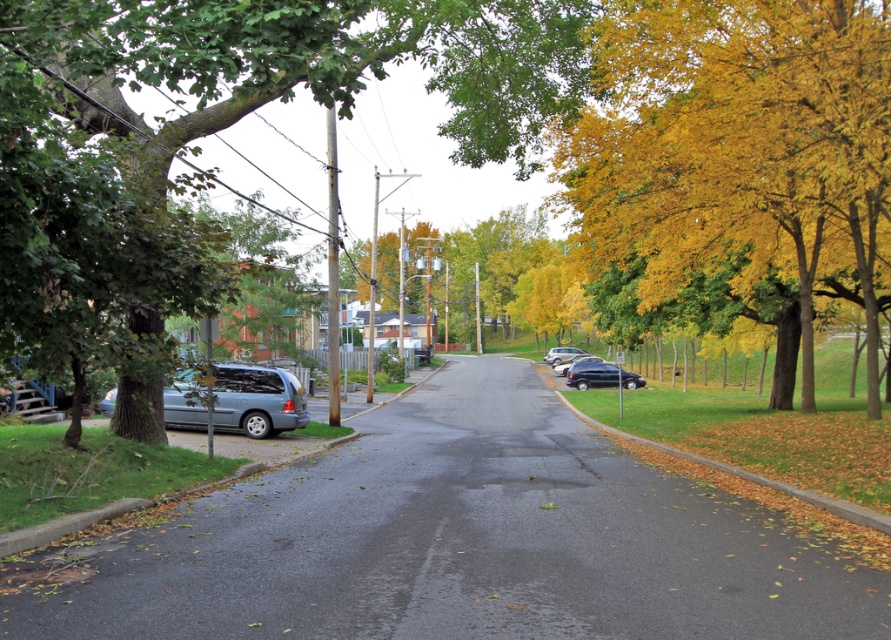
You are standing on the residential street and want to walk to the point marked at coordinates (554, 330). How far will you have to walk to reach that point?

The point at coordinates (554, 330) is 88.24 meters away from your current position, so you will have to walk 88.24 meters to reach it.

Based on the photo, you are a delivery person trying to park your van behind the shiny black sedan at center so that it is hidden from view from the road. Can you park the van behind the green leafy tree at left to block the view of the sedan?

The green leafy tree at left is taller than the shiny black sedan at center, so parking the van behind the tree would effectively block the view of the sedan from the road.